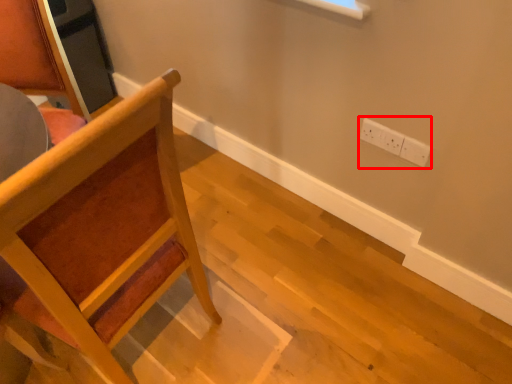
Question: From the image's perspective, what is the correct spatial relationship of electric outlet (annotated by the red box) in relation to chair?

Choices:
 (A) below
 (B) above

Answer: (B)